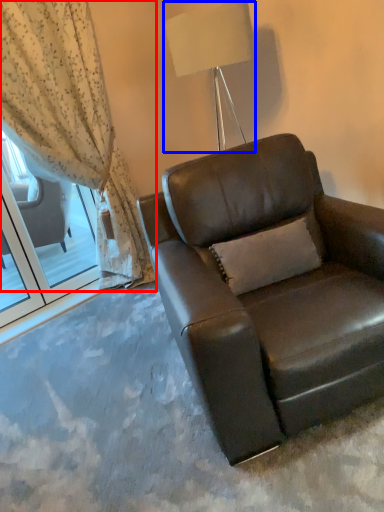
Question: Which point is closer to the camera, curtain (highlighted by a red box) or lamp (highlighted by a blue box)?

Choices:
 (A) curtain
 (B) lamp

Answer: (B)